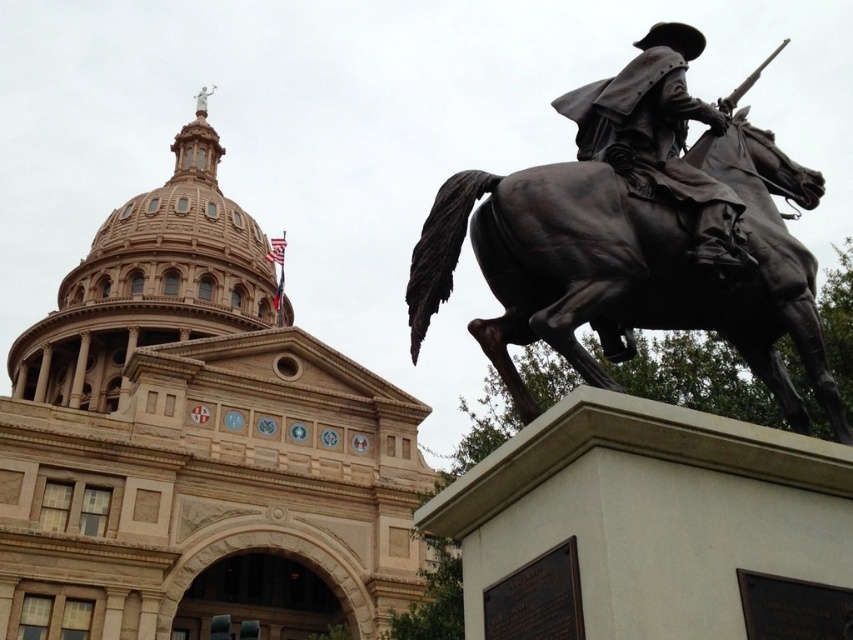
Is point (550, 320) farther from viewer compared to point (666, 138)?

No.

Does point (410, 324) come in front of point (733, 195)?

That is False.

In order to click on bronze at right in this screenshot , I will do `click(628, 266)`.